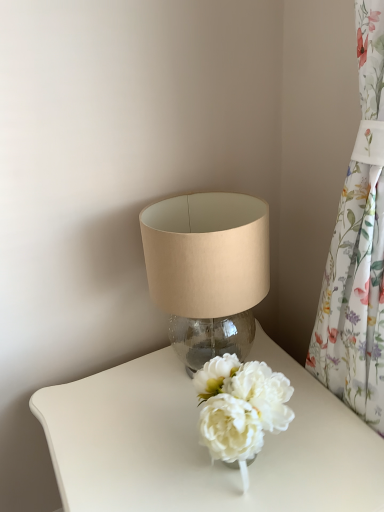
Question: From the image's perspective, is white glossy table at center above floral fabric curtain at right?

Choices:
 (A) yes
 (B) no

Answer: (B)

Question: Is white glossy table at center shorter than floral fabric curtain at right?

Choices:
 (A) yes
 (B) no

Answer: (A)

Question: Can you confirm if white glossy table at center is positioned to the left of floral fabric curtain at right?

Choices:
 (A) yes
 (B) no

Answer: (A)

Question: Is there a large distance between white glossy table at center and floral fabric curtain at right?

Choices:
 (A) no
 (B) yes

Answer: (A)

Question: Does white glossy table at center come behind floral fabric curtain at right?

Choices:
 (A) no
 (B) yes

Answer: (B)

Question: Is white glossy table at center wider than floral fabric curtain at right?

Choices:
 (A) yes
 (B) no

Answer: (A)

Question: Is floral fabric curtain at right positioned far away from translucent glass lampshade at upper center?

Choices:
 (A) no
 (B) yes

Answer: (A)

Question: Is floral fabric curtain at right shorter than translucent glass lampshade at upper center?

Choices:
 (A) yes
 (B) no

Answer: (B)

Question: Is the position of floral fabric curtain at right less distant than that of translucent glass lampshade at upper center?

Choices:
 (A) no
 (B) yes

Answer: (B)

Question: Considering the relative sizes of floral fabric curtain at right and translucent glass lampshade at upper center in the image provided, is floral fabric curtain at right wider than translucent glass lampshade at upper center?

Choices:
 (A) no
 (B) yes

Answer: (A)

Question: Is floral fabric curtain at right facing towards translucent glass lampshade at upper center?

Choices:
 (A) no
 (B) yes

Answer: (A)

Question: Considering the relative positions of floral fabric curtain at right and translucent glass lampshade at upper center in the image provided, is floral fabric curtain at right to the left of translucent glass lampshade at upper center from the viewer's perspective?

Choices:
 (A) yes
 (B) no

Answer: (B)

Question: Is white glossy table at center surrounded by floral fabric curtain at right?

Choices:
 (A) yes
 (B) no

Answer: (B)